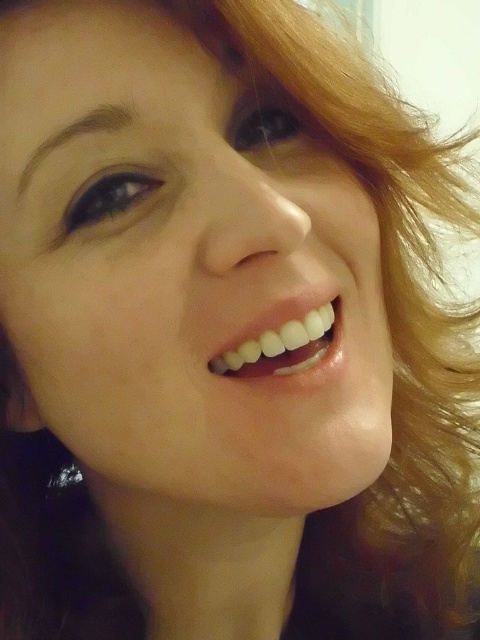
Question: Among these points, which one is farthest from the camera?

Choices:
 (A) (284, 284)
 (B) (256, 353)

Answer: (B)

Question: Is the position of smooth skin face at center more distant than that of white glossy teeth at center?

Choices:
 (A) yes
 (B) no

Answer: (B)

Question: Among these points, which one is nearest to the camera?

Choices:
 (A) (112, 3)
 (B) (323, 314)

Answer: (A)

Question: Does smooth skin face at center have a greater width compared to white glossy teeth at center?

Choices:
 (A) yes
 (B) no

Answer: (A)

Question: From the image, what is the correct spatial relationship of smooth skin face at center in relation to white glossy teeth at center?

Choices:
 (A) above
 (B) below

Answer: (A)